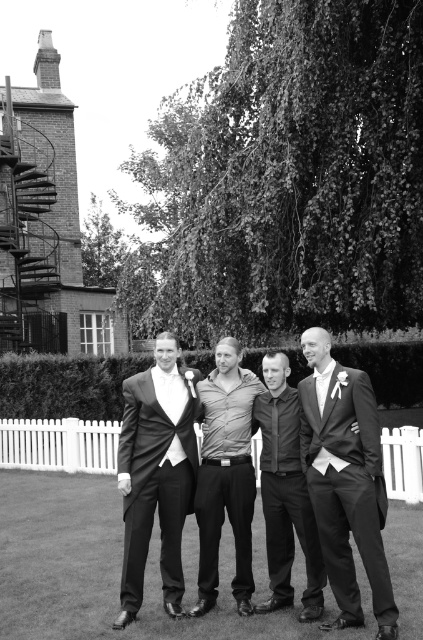
Question: Which object is the farthest from the dark gray shirt at center?

Choices:
 (A) matte black suit at center
 (B) matte black suit at left
 (C) smooth gray shirt at center
 (D) shiny black suit at right

Answer: (B)

Question: Which object is closer to the camera taking this photo?

Choices:
 (A) shiny black suit at right
 (B) matte black suit at left
 (C) smooth gray shirt at center
 (D) matte black suit at center

Answer: (A)

Question: Considering the relative positions of matte black suit at left and smooth gray shirt at center in the image provided, where is matte black suit at left located with respect to smooth gray shirt at center?

Choices:
 (A) below
 (B) above

Answer: (B)

Question: Is shiny black suit at right below dark gray shirt at center?

Choices:
 (A) no
 (B) yes

Answer: (A)

Question: Is shiny black suit at right to the left of dark gray shirt at center from the viewer's perspective?

Choices:
 (A) no
 (B) yes

Answer: (A)

Question: Among these points, which one is farthest from the camera?

Choices:
 (A) (128, 515)
 (B) (285, 476)

Answer: (B)